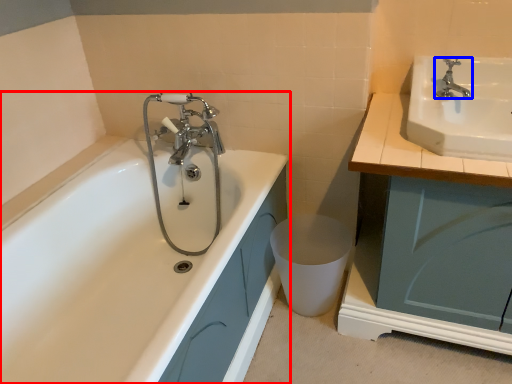
Question: Which of the following is the farthest to the observer, bathtub (highlighted by a red box) or tap (highlighted by a blue box)?

Choices:
 (A) bathtub
 (B) tap

Answer: (B)